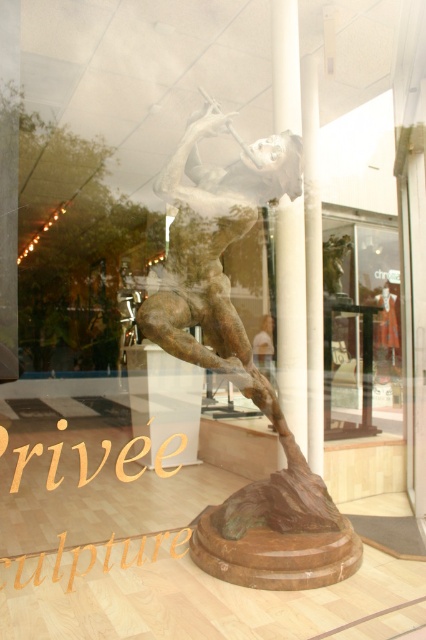
Does bronze sculpture at center have a larger size compared to clear glass display at center?

Incorrect, bronze sculpture at center is not larger than clear glass display at center.

Can you confirm if bronze sculpture at center is positioned above clear glass display at center?

Yes.

Locate an element on the screen. The image size is (426, 640). bronze sculpture at center is located at coordinates (241, 368).